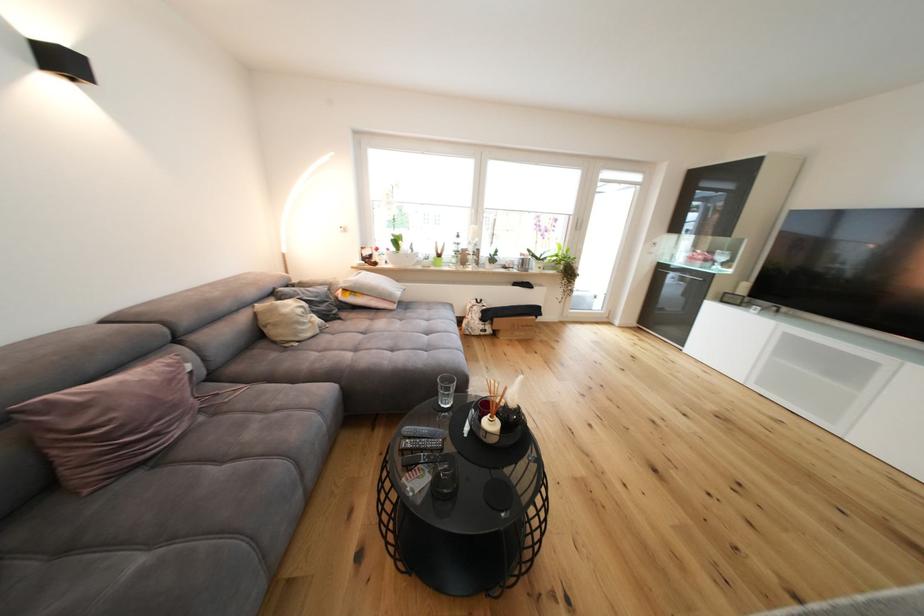
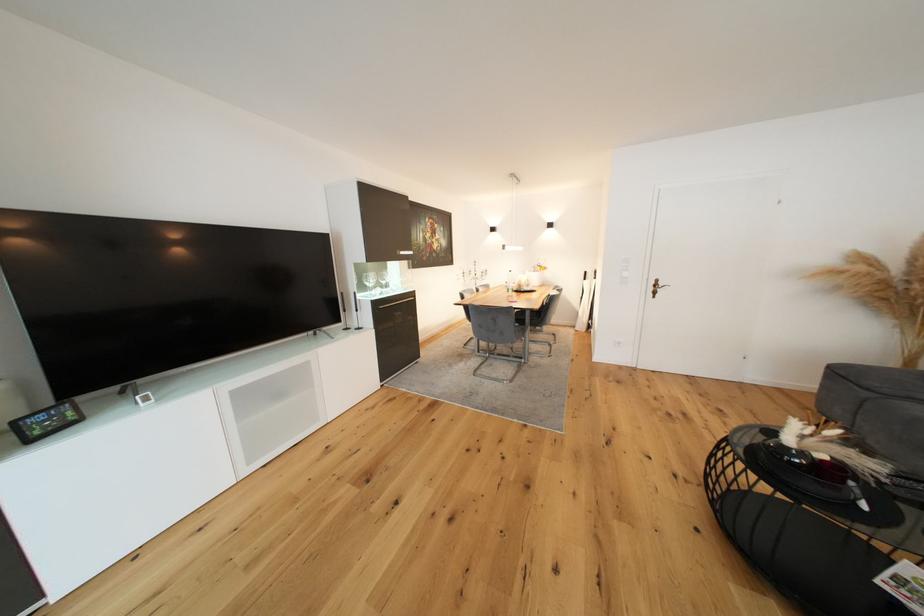
The point at [733,302] is marked in the first image. Where is the corresponding point in the second image?

(44, 434)